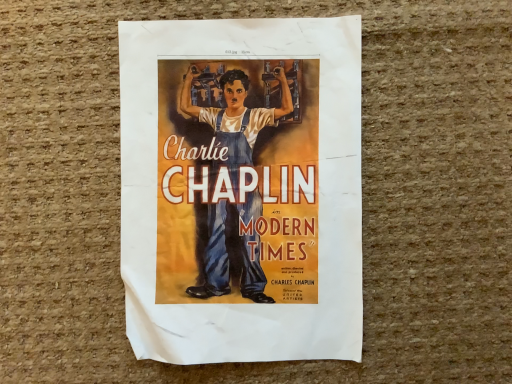
Describe the element at coordinates (242, 189) in the screenshot. The height and width of the screenshot is (384, 512). I see `matte paper poster at center` at that location.

The height and width of the screenshot is (384, 512). What are the coordinates of `matte paper poster at center` in the screenshot? It's located at (242, 189).

Find the location of a particular element. The height and width of the screenshot is (384, 512). matte paper poster at center is located at coordinates (242, 189).